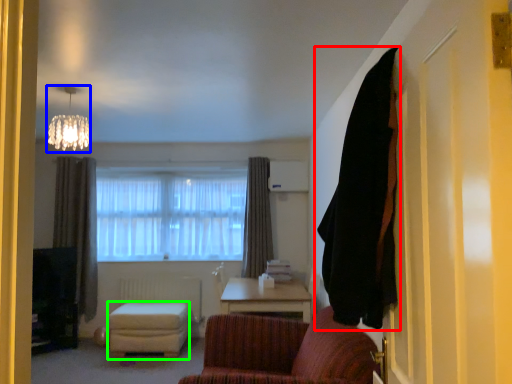
Question: Which object is the farthest from curtain (highlighted by a red box)? Choose among these: lamp (highlighted by a blue box) or stool (highlighted by a green box).

Choices:
 (A) lamp
 (B) stool

Answer: (B)